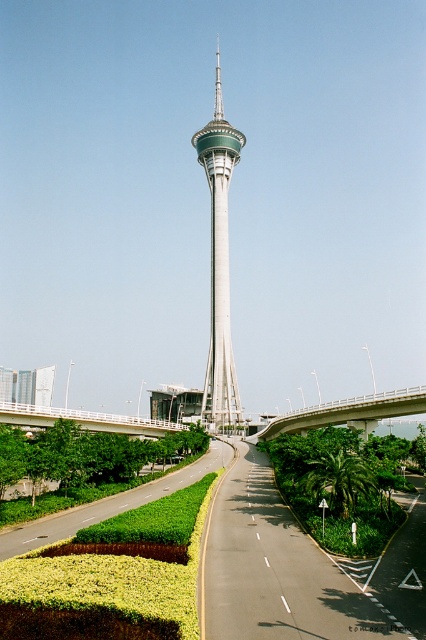
You are a drone operator planning to fly a drone from the green metallic tower at center to the white concrete bridge at center. Based on the scene, can you determine if the drone can descend directly from the tower to the bridge without any obstacles?

The green metallic tower at center is above the white concrete bridge at center, so the drone can descend directly from the green metallic tower at center to the white concrete bridge at center without any obstacles.

You are standing at the point marked as point (330, 410) near the Macau Tower. If you want to take a photo of the tower from where you are, will you be able to capture the entire tower in your shot without moving? The camera you are using has a standard field of view.

The point (330, 410) is 357.37 feet away from the camera. Given the distance and the standard field of view of the camera, it is possible to capture the entire Macau Tower in the shot without moving.